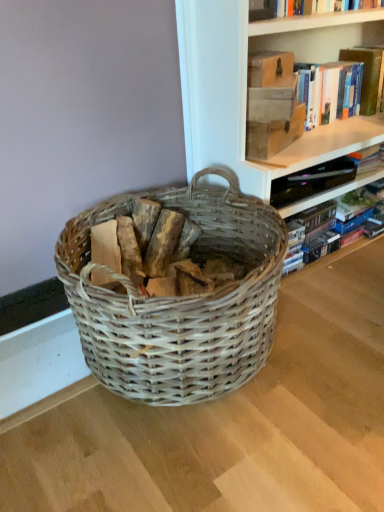
Question: From the image's perspective, is wooden logs at center over hardcover book at upper right, which is the 2th book from top to bottom?

Choices:
 (A) yes
 (B) no

Answer: (B)

Question: Is wooden logs at center aimed at hardcover book at upper right, which is the 2th book from top to bottom?

Choices:
 (A) yes
 (B) no

Answer: (B)

Question: Are wooden logs at center and hardcover book at upper right, which is the 2th book from top to bottom, beside each other?

Choices:
 (A) no
 (B) yes

Answer: (A)

Question: Can you confirm if wooden logs at center is positioned to the right of hardcover book at upper right, placed as the first book when sorted from bottom to top?

Choices:
 (A) yes
 (B) no

Answer: (B)

Question: Can you confirm if wooden logs at center is smaller than hardcover book at upper right, placed as the first book when sorted from bottom to top?

Choices:
 (A) yes
 (B) no

Answer: (A)

Question: Looking at their shapes, would you say wooden logs at center is wider or thinner than hardcover book at upper right, which is the 1th book from top to bottom?

Choices:
 (A) thin
 (B) wide

Answer: (B)

Question: Is wooden logs at center in front of or behind hardcover book at upper right, which is the 1th book from top to bottom, in the image?

Choices:
 (A) front
 (B) behind

Answer: (A)

Question: In terms of height, does wooden logs at center look taller or shorter compared to hardcover book at upper right, which is counted as the second book, starting from the bottom?

Choices:
 (A) tall
 (B) short

Answer: (B)

Question: In the image, is wooden logs at center on the left side or the right side of hardcover book at upper right, which is the 1th book from top to bottom?

Choices:
 (A) left
 (B) right

Answer: (A)

Question: In terms of size, does hardcover book at upper right, which is the 2th book from top to bottom, appear bigger or smaller than wooden logs at center?

Choices:
 (A) small
 (B) big

Answer: (B)

Question: In terms of height, does hardcover book at upper right, which is the 2th book from top to bottom, look taller or shorter compared to wooden logs at center?

Choices:
 (A) short
 (B) tall

Answer: (A)

Question: Is hardcover book at upper right, placed as the first book when sorted from bottom to top, in front of or behind wooden logs at center in the image?

Choices:
 (A) front
 (B) behind

Answer: (B)

Question: From a real-world perspective, is hardcover book at upper right, which is the 2th book from top to bottom, above or below wooden logs at center?

Choices:
 (A) below
 (B) above

Answer: (A)

Question: From the image's perspective, is matte brown book at upper right, the 1th paperback book when ordered from bottom to top, located above or below hardcover book at upper right, placed as the first book when sorted from bottom to top?

Choices:
 (A) below
 (B) above

Answer: (B)

Question: From a real-world perspective, is matte brown book at upper right, the 1th paperback book when ordered from bottom to top, positioned above or below hardcover book at upper right, which is the 2th book from top to bottom?

Choices:
 (A) above
 (B) below

Answer: (A)